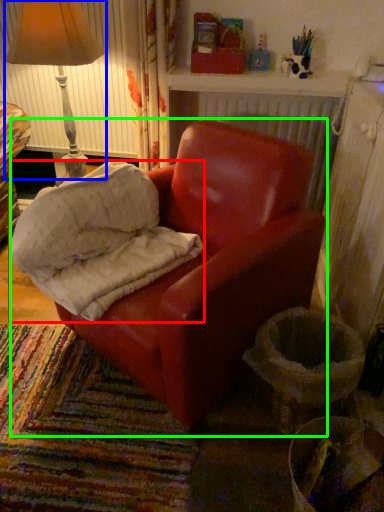
Question: Estimate the real-world distances between objects in this image. Which object is closer to material (highlighted by a red box), lamp (highlighted by a blue box) or chair (highlighted by a green box)?

Choices:
 (A) lamp
 (B) chair

Answer: (B)